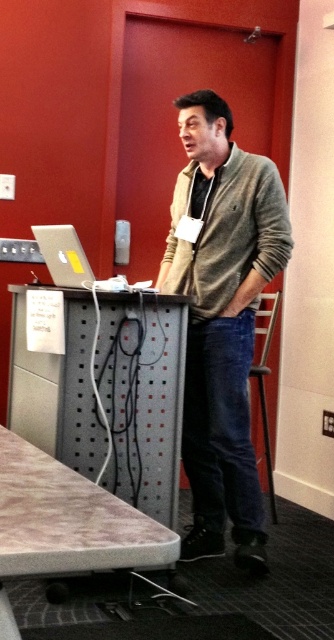
You are a person standing in the conference room and you see the point at coordinates (69, 520). Where is that point located?

The point at coordinates (69, 520) is on the wooden table at lower left.